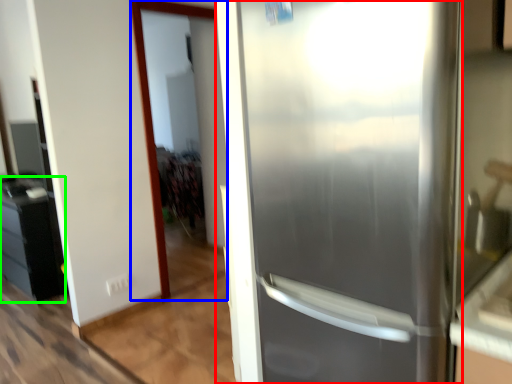
Question: Estimate the real-world distances between objects in this image. Which object is farther from refrigerator (highlighted by a red box), screen door (highlighted by a blue box) or cabinetry (highlighted by a green box)?

Choices:
 (A) screen door
 (B) cabinetry

Answer: (B)